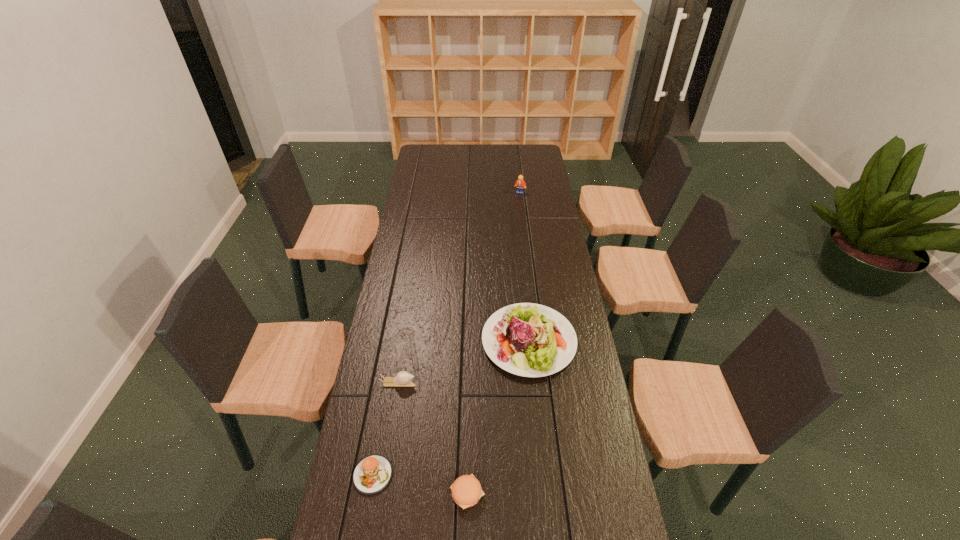
Find the location of a particular element. free spot between the tallest object and the left patty is located at coordinates (446, 334).

The height and width of the screenshot is (540, 960). I want to click on free point between the escargot and the right patty, so click(x=433, y=438).

The width and height of the screenshot is (960, 540). What are the coordinates of `free space between the second tallest object and the left patty` in the screenshot? It's located at (451, 408).

You are a GUI agent. You are given a task and a screenshot of the screen. Output one action in this format:
    pyautogui.click(x=<x>, y=<y>)
    Task: Click on the unoccupied area between the right patty and the left patty
    
    Given the screenshot: What is the action you would take?
    pyautogui.click(x=420, y=484)

Find the location of a particular element. The image size is (960, 540). vacant area between the left patty and the escargot is located at coordinates (386, 429).

Where is `free space between the escargot and the fourth shortest object`? This screenshot has height=540, width=960. free space between the escargot and the fourth shortest object is located at coordinates (464, 362).

Where is `free space between the left patty and the tallest object`? The width and height of the screenshot is (960, 540). free space between the left patty and the tallest object is located at coordinates (446, 334).

Locate which object is the fourth closest to the right patty. Please provide its 2D coordinates. Your answer should be formatted as a tuple, i.e. [(x, y)], where the tuple contains the x and y coordinates of a point satisfying the conditions above.

[(520, 184)]

This screenshot has height=540, width=960. Identify the location of the fourth closest object relative to the Lego. (466, 491).

You are a GUI agent. You are given a task and a screenshot of the screen. Output one action in this format:
    pyautogui.click(x=<x>, y=<y>)
    Task: Click on the free spot that satisfies the following two spatial constraints: 1. on the back side of the right patty; 2. on the shell of the third shortest object
    This screenshot has width=960, height=540.
    Given the screenshot: What is the action you would take?
    pyautogui.click(x=469, y=383)